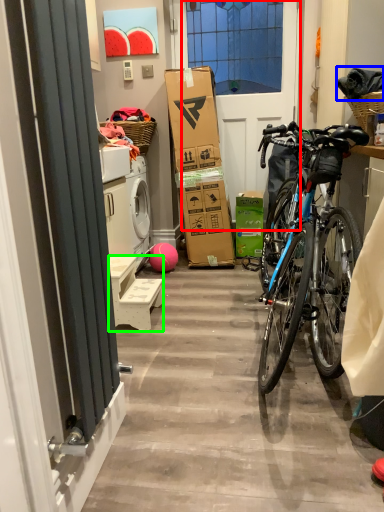
Question: Which object is positioned closest to screen door (highlighted by a red box)? Select from material (highlighted by a blue box) and furniture (highlighted by a green box).

Choices:
 (A) material
 (B) furniture

Answer: (A)